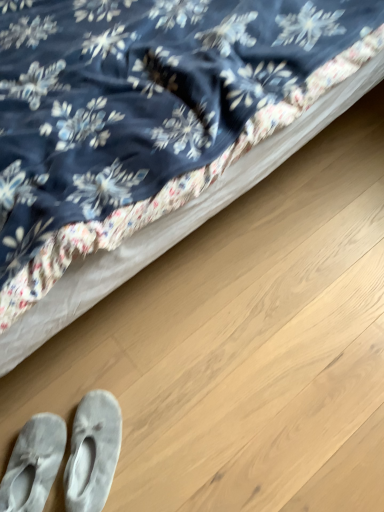
Question: From the image's perspective, relative to gray suede slippers at lower left, the 2th footwear viewed from the right, is velvety blue bed at upper left above or below?

Choices:
 (A) above
 (B) below

Answer: (A)

Question: Is point (311, 35) closer or farther from the camera than point (13, 493)?

Choices:
 (A) closer
 (B) farther

Answer: (B)

Question: Based on their relative distances, which object is farther from the velvety blue bed at upper left?

Choices:
 (A) gray suede slippers at lower left, the 2th footwear viewed from the right
 (B) light gray suede slippers at lower left, arranged as the second footwear when viewed from the left

Answer: (A)

Question: Estimate the real-world distances between objects in this image. Which object is farther from the light gray suede slippers at lower left, which is the 1th footwear in right-to-left order?

Choices:
 (A) gray suede slippers at lower left, acting as the first footwear starting from the left
 (B) velvety blue bed at upper left

Answer: (B)